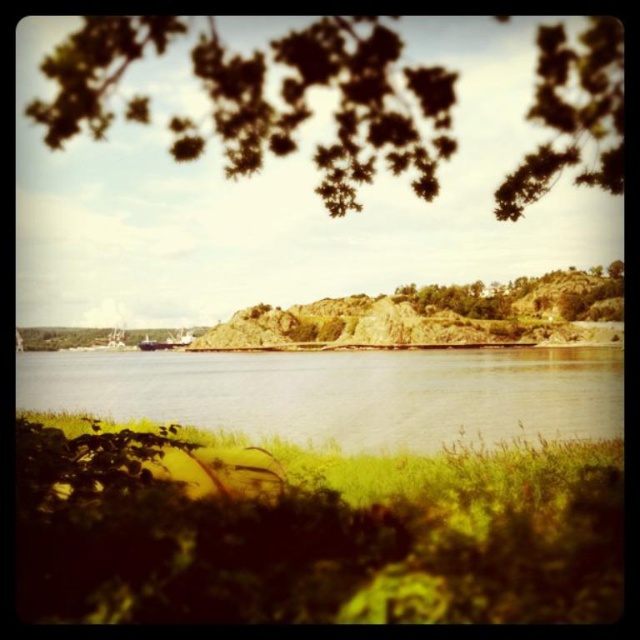
You are standing at a viewpoint overlooking the coast and want to know how far the point at coordinates point (237,417) is from you. Can you determine the distance?

The distance between you and point (237,417) is 116.88 meters.

You are a hiker who wants to walk from the dark green leaves at upper center to the green rough textured rock at center. Given that your average walking pace is 3 miles per hour, how long would it take you to reach the rock?

The distance between dark green leaves at upper center and green rough textured rock at center is 237.24 feet. Converting feet to miles, 237.24 feet is approximately 0.045 miles. At a walking pace of 3 miles per hour, it would take roughly 0.045 divided by 3 equals 0.015 hours, which is about 0.9 minutes or approximately 54 seconds.

You are standing at the edge of a small pond in the coastal landscape and want to cross to the other side. The clear water at center and the green rough textured rock at center are in your path. Which object should you step on to avoid getting wet?

You should step on the green rough textured rock at center because the clear water at center is shorter than the rock, meaning the rock is above the water level and provides a dry path.